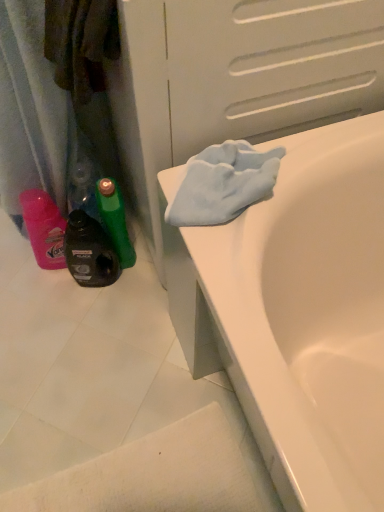
Question: From the image's perspective, is black plastic bottle at lower left positioned above or below white glossy bathtub at upper right?

Choices:
 (A) above
 (B) below

Answer: (A)

Question: From a real-world perspective, is black plastic bottle at lower left positioned above or below white glossy bathtub at upper right?

Choices:
 (A) above
 (B) below

Answer: (B)

Question: Looking at the image, does black plastic bottle at lower left seem bigger or smaller compared to white glossy bathtub at upper right?

Choices:
 (A) small
 (B) big

Answer: (A)

Question: From the image's perspective, relative to black plastic bottle at lower left, is white glossy bathtub at upper right above or below?

Choices:
 (A) below
 (B) above

Answer: (A)

Question: In terms of height, does white glossy bathtub at upper right look taller or shorter compared to black plastic bottle at lower left?

Choices:
 (A) tall
 (B) short

Answer: (A)

Question: Does point (243, 323) appear closer or farther from the camera than point (104, 238)?

Choices:
 (A) closer
 (B) farther

Answer: (A)

Question: Relative to black plastic bottle at lower left, is white glossy bathtub at upper right in front or behind?

Choices:
 (A) behind
 (B) front

Answer: (B)